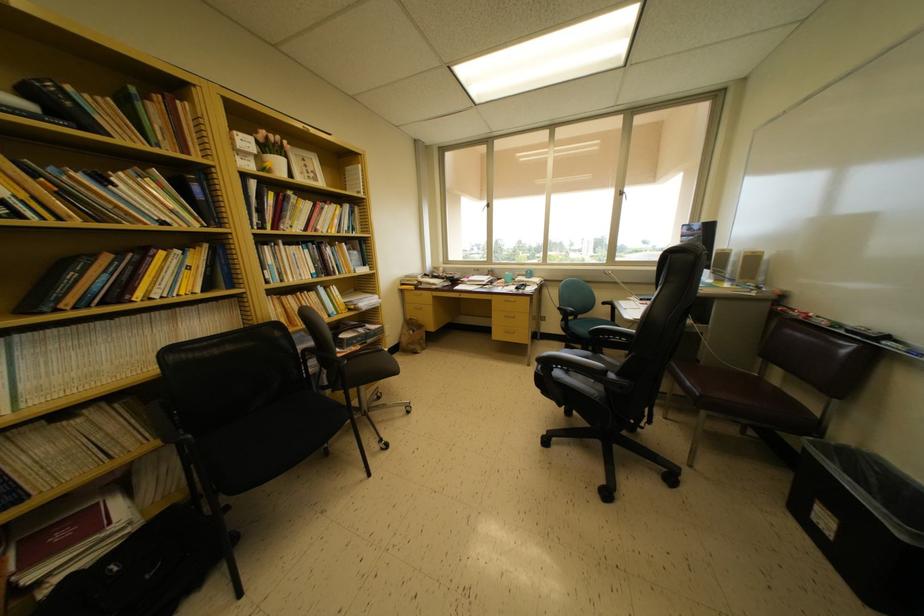
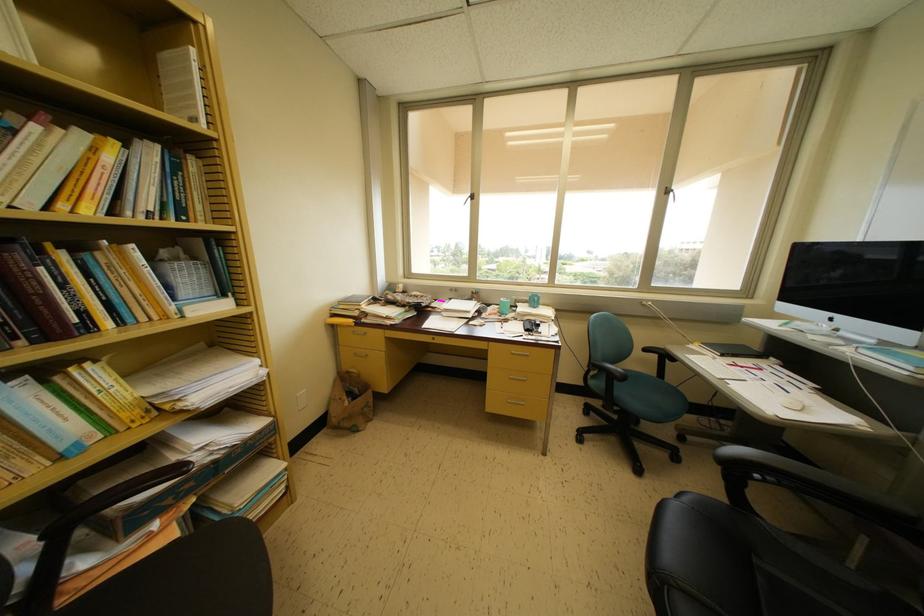
The point at (533,280) is marked in the first image. Where is the corresponding point in the second image?

(538, 306)